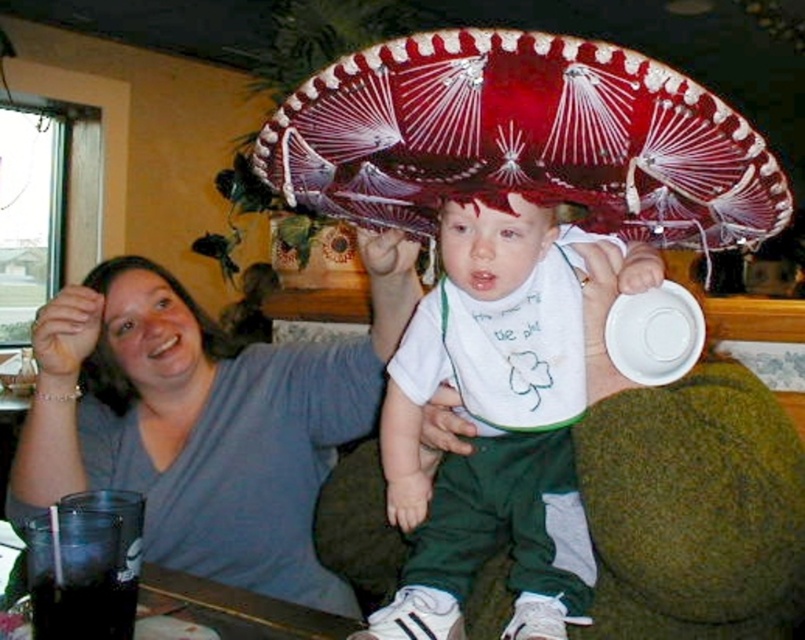
Is point (539, 520) behind point (464, 237)?

Yes, point (539, 520) is behind point (464, 237).

Is white cotton bib at center thinner than matte red sombrero at center?

Incorrect, white cotton bib at center's width is not less than matte red sombrero at center's.

Does point (418, 308) come behind point (477, 280)?

Yes.

This screenshot has width=805, height=640. Find the location of `white cotton bib at center`. white cotton bib at center is located at coordinates (492, 426).

Can you confirm if matte gray shirt at upper left is positioned to the right of matte red sombrero at center?

No, matte gray shirt at upper left is not to the right of matte red sombrero at center.

Who is taller, matte gray shirt at upper left or matte red sombrero at center?

matte gray shirt at upper left

Is point (322, 572) less distant than point (457, 237)?

No.

The height and width of the screenshot is (640, 805). I want to click on matte gray shirt at upper left, so click(205, 420).

Does white cotton bib at center have a smaller size compared to matte gray head at upper left?

Yes, white cotton bib at center is smaller than matte gray head at upper left.

Is point (407, 444) behind point (89, 285)?

No, (407, 444) is closer to viewer.

Image resolution: width=805 pixels, height=640 pixels. What are the coordinates of `white cotton bib at center` in the screenshot? It's located at (492, 426).